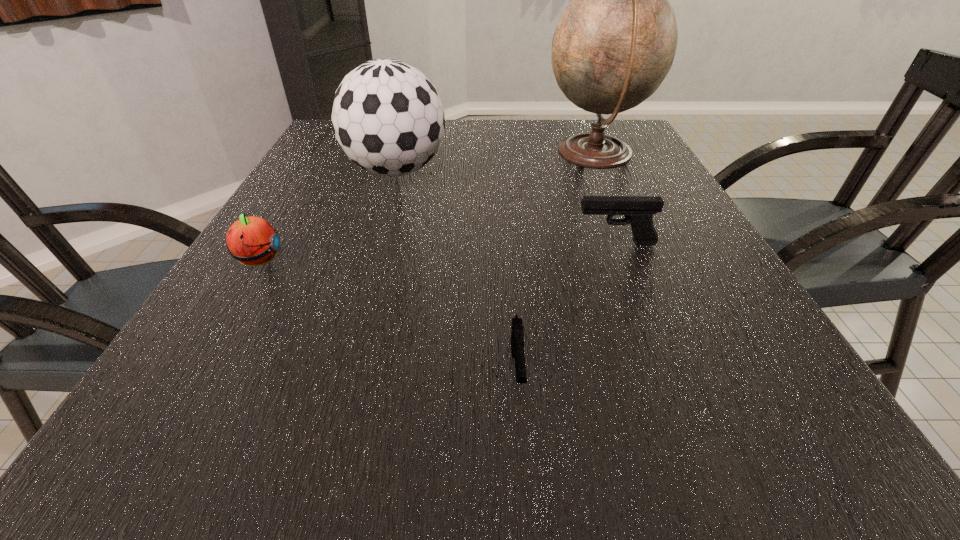
Find the location of a particular element. The image size is (960, 540). apple that is at the left edge is located at coordinates (251, 240).

Image resolution: width=960 pixels, height=540 pixels. What are the coordinates of `globe positioned at the right edge` in the screenshot? It's located at (615, 43).

At what (x,y) coordinates should I click in order to perform the action: click on pistol that is at the right edge. Please return your answer as a coordinate pair (x, y). Image resolution: width=960 pixels, height=540 pixels. Looking at the image, I should click on (638, 211).

Locate an element on the screen. The image size is (960, 540). object located in the far left corner section of the desktop is located at coordinates (387, 116).

Identify the location of object present at the far right corner. (615, 43).

Find the location of `vacant region at the far edge`. vacant region at the far edge is located at coordinates (492, 152).

The width and height of the screenshot is (960, 540). Identify the location of free region at the near edge of the desktop. (391, 451).

In the image, there is a desktop. Where is `vacant space at the left edge`? vacant space at the left edge is located at coordinates (313, 214).

Locate an element on the screen. This screenshot has height=540, width=960. free space at the right edge of the desktop is located at coordinates (615, 186).

The width and height of the screenshot is (960, 540). Identify the location of free space at the far left corner. (320, 149).